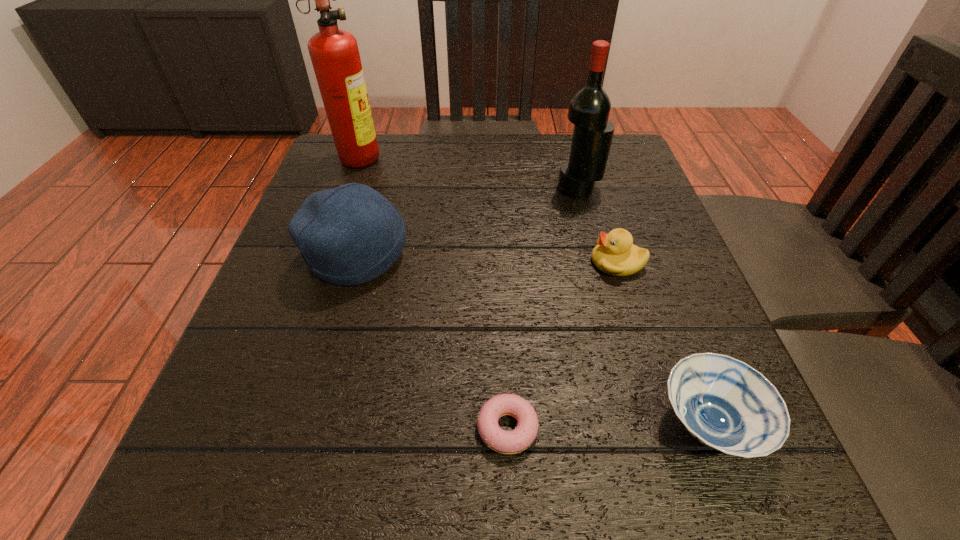
What are the coordinates of `doughnut situated at the near edge` in the screenshot? It's located at (506, 442).

The image size is (960, 540). I want to click on fire extinguisher that is at the left edge, so click(334, 53).

Find the location of `skullcap situated at the left edge`. skullcap situated at the left edge is located at coordinates (349, 235).

Find the location of a particular element. This screenshot has width=960, height=540. wine bottle located at the right edge is located at coordinates (589, 108).

Where is `duckling that is at the right edge`? The width and height of the screenshot is (960, 540). duckling that is at the right edge is located at coordinates (615, 254).

At what (x,y) coordinates should I click in order to perform the action: click on soup bowl that is at the right edge. Please return your answer as a coordinate pair (x, y). Looking at the image, I should click on (724, 403).

What are the coordinates of `object located in the far left corner section of the desktop` in the screenshot? It's located at (334, 53).

At what (x,y) coordinates should I click in order to perform the action: click on object present at the far right corner. Please return your answer as a coordinate pair (x, y). Looking at the image, I should click on (589, 108).

The height and width of the screenshot is (540, 960). Identify the location of object present at the near right corner. (724, 403).

Where is `vacant space at the far edge`? The height and width of the screenshot is (540, 960). vacant space at the far edge is located at coordinates (504, 135).